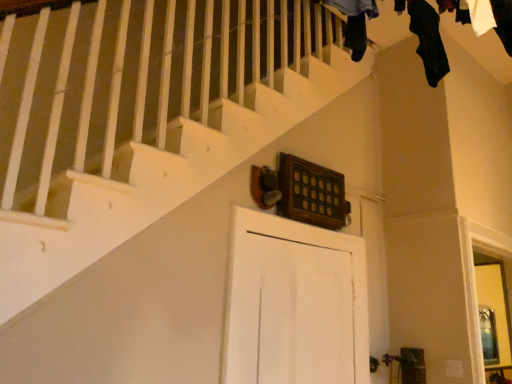
Question: Is point (289, 370) positioned closer to the camera than point (357, 21)?

Choices:
 (A) farther
 (B) closer

Answer: (A)

Question: Considering their positions, is white matte door at center located in front of or behind black fabric at upper center, arranged as the second clothing when viewed from the back?

Choices:
 (A) behind
 (B) front

Answer: (A)

Question: Which object is the closest to the black fabric at upper center, which is counted as the second clothing, starting from the right?

Choices:
 (A) black fabric at upper right, arranged as the 2th clothing when viewed from the left
 (B) white matte door at center

Answer: (A)

Question: Which is nearer to the black fabric at upper right, arranged as the 2th clothing when viewed from the left?

Choices:
 (A) black fabric at upper center, the 1th clothing viewed from the front
 (B) white matte door at center

Answer: (A)